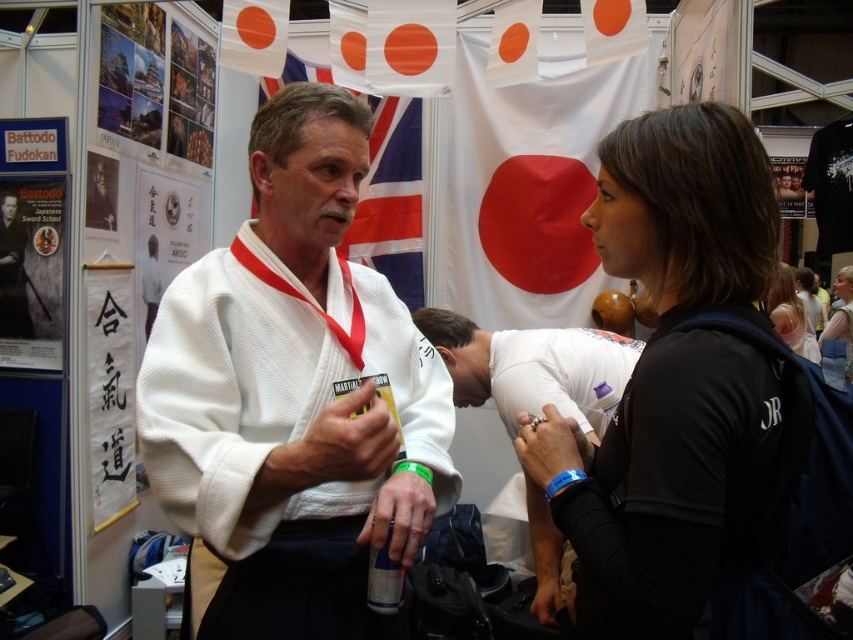
Who is shorter, black matte jacket at center or white matte kimono at center?

white matte kimono at center

Does black matte jacket at center appear on the right side of white matte kimono at center?

Indeed, black matte jacket at center is positioned on the right side of white matte kimono at center.

Between point (695, 388) and point (547, 560), which one is positioned behind?

Point (547, 560)

This screenshot has height=640, width=853. I want to click on black matte jacket at center, so click(672, 378).

Is black fabric shirt at right to the left of blue fabric shirt at upper right from the viewer's perspective?

Yes, black fabric shirt at right is to the left of blue fabric shirt at upper right.

Which is more to the left, black fabric shirt at right or blue fabric shirt at upper right?

From the viewer's perspective, black fabric shirt at right appears more on the left side.

I want to click on black fabric shirt at right, so click(790, 314).

Can you confirm if white cotton kimono at center is thinner than black fabric shirt at right?

Correct, white cotton kimono at center's width is less than black fabric shirt at right's.

What do you see at coordinates (293, 396) in the screenshot? Image resolution: width=853 pixels, height=640 pixels. I see `white cotton kimono at center` at bounding box center [293, 396].

This screenshot has width=853, height=640. What are the coordinates of `white cotton kimono at center` in the screenshot? It's located at (293, 396).